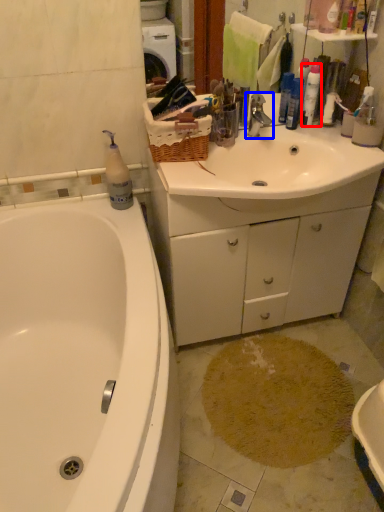
Question: Among these objects, which one is farthest to the camera, cleaning product (highlighted by a red box) or tap (highlighted by a blue box)?

Choices:
 (A) cleaning product
 (B) tap

Answer: (A)